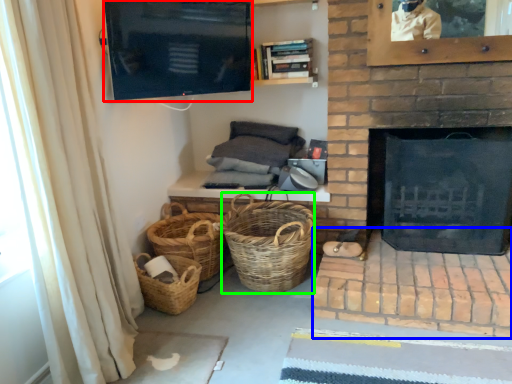
Question: Estimate the real-world distances between objects in this image. Which object is farther from screen door (highlighted by a red box), brickwork (highlighted by a blue box) or basket (highlighted by a green box)?

Choices:
 (A) brickwork
 (B) basket

Answer: (A)